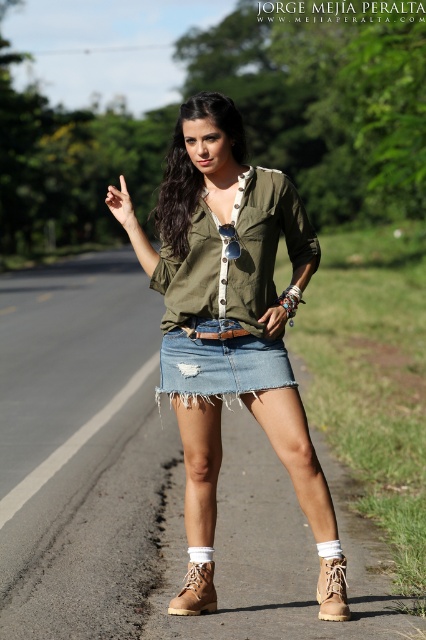
Question: Among these objects, which one is farthest from the camera?

Choices:
 (A) denim skirt at center
 (B) tan suede boot at lower center

Answer: (A)

Question: Which object is positioned farthest from the ripped denim skirt at center?

Choices:
 (A) denim skirt at center
 (B) tan suede boot at lower center

Answer: (B)

Question: Among these objects, which one is farthest from the camera?

Choices:
 (A) tan suede boot at lower center
 (B) denim skirt at center

Answer: (B)

Question: Does denim skirt at center have a smaller size compared to ripped denim skirt at center?

Choices:
 (A) no
 (B) yes

Answer: (A)

Question: In this image, where is denim skirt at center located relative to ripped denim skirt at center?

Choices:
 (A) left
 (B) right

Answer: (A)

Question: Does denim skirt at center appear on the left side of tan suede boot at lower center?

Choices:
 (A) yes
 (B) no

Answer: (A)